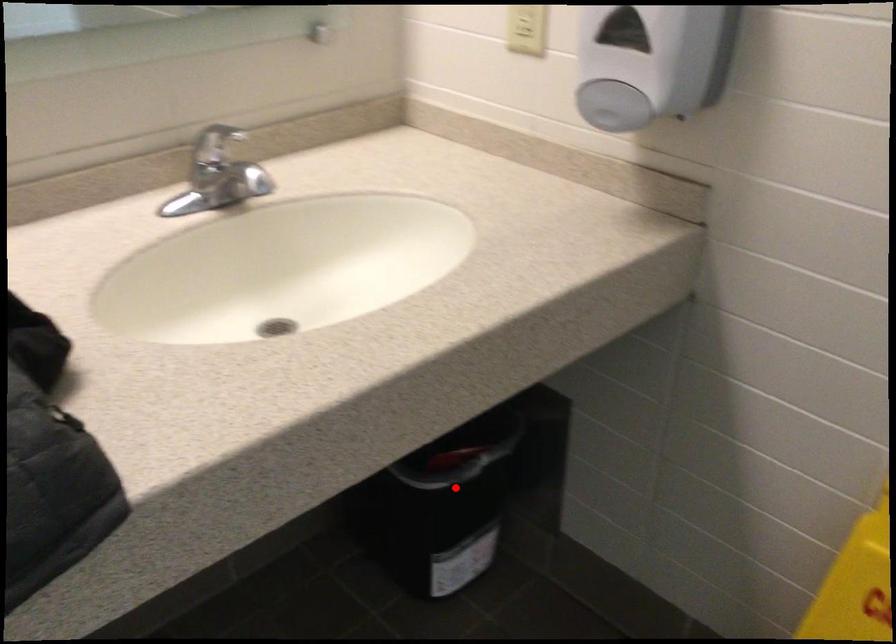
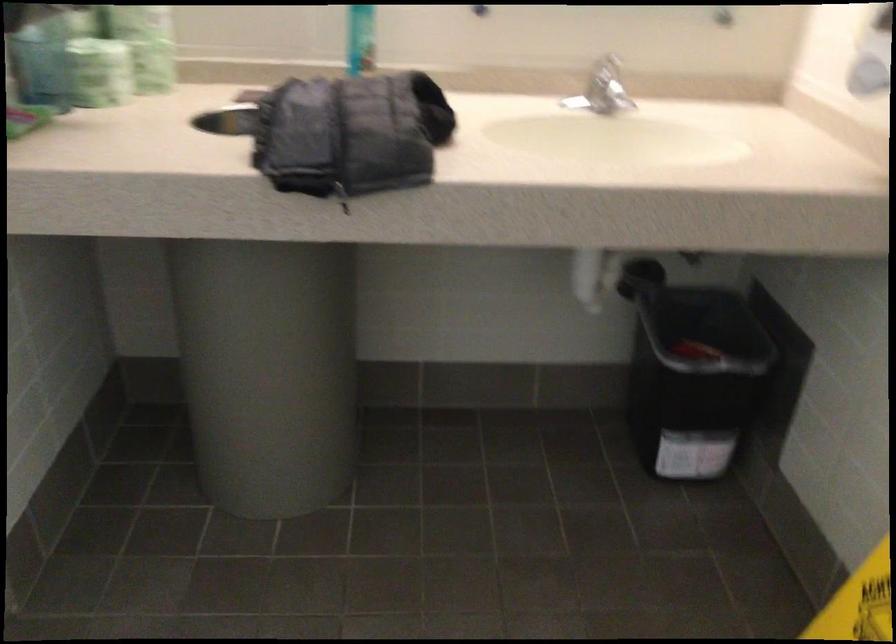
Question: I am providing you with two images of the same scene from different viewpoints. Image1 has a red point marked. In image2, the corresponding 3D location appears at what relative position? Reply with the corresponding letter.

Choices:
 (A) Closer
 (B) Farther

Answer: (B)